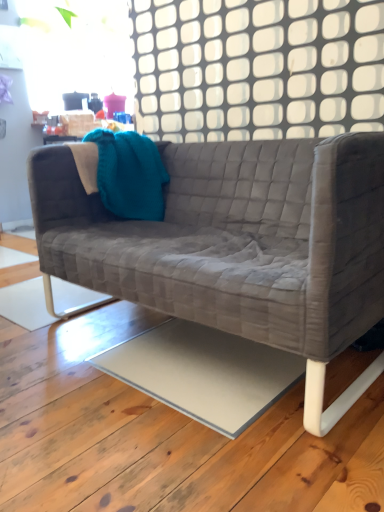
What is the approximate width of teal knitted throw pillow at upper left?

It is 13.16 inches.

Measure the distance between white grid at upper center and camera.

1.35 meters.

Locate an element on the screen. The image size is (384, 512). teal knitted throw pillow at upper left is located at coordinates (129, 174).

Which object is further away from the camera taking this photo, white grid at upper center or velvet grey couch at center?

white grid at upper center is more distant.

Considering the positions of points (198, 115) and (352, 314), is point (198, 115) closer to camera compared to point (352, 314)?

No, (198, 115) is behind (352, 314).

Is white grid at upper center looking in the opposite direction of velvet grey couch at center?

No, white grid at upper center is not facing away from velvet grey couch at center.

Consider the image. Can you confirm if white grid at upper center is positioned to the right of velvet grey couch at center?

Yes.

Considering the positions of objects velvet grey couch at center and teal knitted throw pillow at upper left in the image provided, who is in front, velvet grey couch at center or teal knitted throw pillow at upper left?

velvet grey couch at center is more forward.

Is velvet grey couch at center aimed at teal knitted throw pillow at upper left?

No, velvet grey couch at center is not aimed at teal knitted throw pillow at upper left.

Consider the image. Measure the distance from velvet grey couch at center to teal knitted throw pillow at upper left.

velvet grey couch at center and teal knitted throw pillow at upper left are 14.75 inches apart.

In the scene shown: What's the angular difference between velvet grey couch at center and teal knitted throw pillow at upper left's facing directions?

The angle between the facing direction of velvet grey couch at center and the facing direction of teal knitted throw pillow at upper left is 90.5 degrees.

Is point (150, 158) positioned behind point (335, 26)?

Yes.

From the image's perspective, relative to white grid at upper center, is teal knitted throw pillow at upper left above or below?

teal knitted throw pillow at upper left is situated lower than white grid at upper center in the image.

From a real-world perspective, is teal knitted throw pillow at upper left located higher than white grid at upper center?

No, from a real-world perspective, teal knitted throw pillow at upper left is not on top of white grid at upper center.

Considering the relative positions of teal knitted throw pillow at upper left and velvet grey couch at center in the image provided, is teal knitted throw pillow at upper left behind velvet grey couch at center?

That is True.

Is velvet grey couch at center inside teal knitted throw pillow at upper left?

No, velvet grey couch at center is not surrounded by teal knitted throw pillow at upper left.

Is point (129, 166) behind point (203, 314)?

Yes, point (129, 166) is behind point (203, 314).

From a real-world perspective, who is located higher, velvet grey couch at center or white grid at upper center?

From a 3D spatial view, white grid at upper center is above.

Is the position of velvet grey couch at center more distant than that of white grid at upper center?

No, it is not.

From the image's perspective, would you say velvet grey couch at center is positioned over white grid at upper center?

No, from the image's perspective, velvet grey couch at center is not on top of white grid at upper center.

How different are the orientations of white grid at upper center and teal knitted throw pillow at upper left in degrees?

white grid at upper center and teal knitted throw pillow at upper left are facing 89.9 degrees away from each other.

Which object is positioned more to the right, white grid at upper center or teal knitted throw pillow at upper left?

Positioned to the right is white grid at upper center.

Which object is closer to the camera, white grid at upper center or teal knitted throw pillow at upper left?

white grid at upper center is closer to the camera.

Is white grid at upper center aimed at teal knitted throw pillow at upper left?

No, white grid at upper center is not aimed at teal knitted throw pillow at upper left.

Locate an element on the screen. The image size is (384, 512). studio couch beneath the white grid at upper center (from a real-world perspective) is located at coordinates (238, 245).

This screenshot has height=512, width=384. What are the coordinates of `throw pillow that appears on the left of velvet grey couch at center` in the screenshot? It's located at (129, 174).

From the image, which object appears to be nearer to velvet grey couch at center, teal knitted throw pillow at upper left or white grid at upper center?

teal knitted throw pillow at upper left is closer to velvet grey couch at center.

Estimate the real-world distances between objects in this image. Which object is further from velvet grey couch at center, white grid at upper center or teal knitted throw pillow at upper left?

Among the two, white grid at upper center is located further to velvet grey couch at center.

Looking at the image, which one is located further to white grid at upper center, teal knitted throw pillow at upper left or velvet grey couch at center?

Based on the image, velvet grey couch at center appears to be further to white grid at upper center.

Based on their spatial positions, is white grid at upper center or velvet grey couch at center further from teal knitted throw pillow at upper left?

Among the two, white grid at upper center is located further to teal knitted throw pillow at upper left.

From the image, which object appears to be nearer to white grid at upper center, velvet grey couch at center or teal knitted throw pillow at upper left?

Based on the image, teal knitted throw pillow at upper left appears to be nearer to white grid at upper center.

Considering their positions, is velvet grey couch at center positioned closer to teal knitted throw pillow at upper left than white grid at upper center?

Among the two, velvet grey couch at center is located nearer to teal knitted throw pillow at upper left.

Find the location of a particular element. The width and height of the screenshot is (384, 512). window positioned between velvet grey couch at center and teal knitted throw pillow at upper left from near to far is located at coordinates (257, 68).